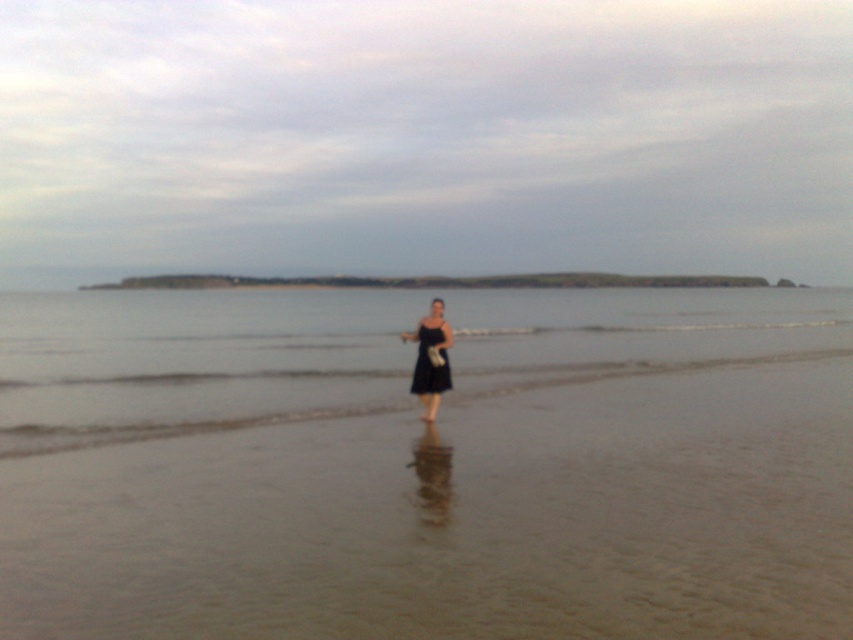
Question: Which object appears farthest from the camera in this image?

Choices:
 (A) black matte dress at center
 (B) clear water at center
 (C) brown sandy beach at center

Answer: (A)

Question: Is clear water at center positioned in front of black satin dress at center?

Choices:
 (A) no
 (B) yes

Answer: (B)

Question: Does black matte dress at center appear under black satin dress at center?

Choices:
 (A) yes
 (B) no

Answer: (A)

Question: Is brown sandy beach at center wider than black matte dress at center?

Choices:
 (A) yes
 (B) no

Answer: (A)

Question: Among these points, which one is nearest to the camera?

Choices:
 (A) (419, 376)
 (B) (436, 337)

Answer: (B)

Question: Among these objects, which one is nearest to the camera?

Choices:
 (A) clear water at center
 (B) black matte dress at center

Answer: (A)